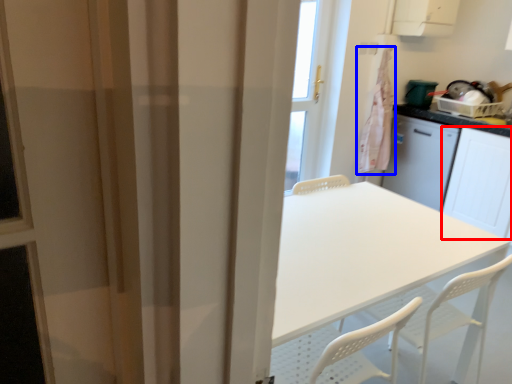
Question: Which object is further to the camera taking this photo, screen door (highlighted by a red box) or laundry (highlighted by a blue box)?

Choices:
 (A) screen door
 (B) laundry

Answer: (B)